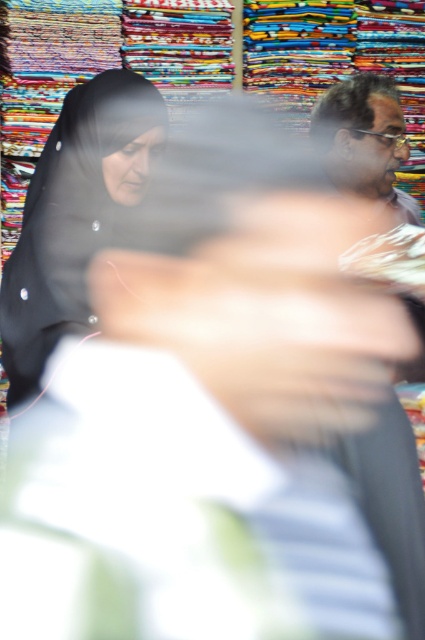
Question: Does matte black headscarf at left have a smaller size compared to matte gray shirt at upper right?

Choices:
 (A) no
 (B) yes

Answer: (A)

Question: Is matte black headscarf at left to the right of matte gray shirt at upper right from the viewer's perspective?

Choices:
 (A) yes
 (B) no

Answer: (B)

Question: Which of the following is the closest to the observer?

Choices:
 (A) matte black headscarf at left
 (B) matte gray shirt at upper right

Answer: (A)

Question: Does matte black headscarf at left appear over matte gray shirt at upper right?

Choices:
 (A) yes
 (B) no

Answer: (B)